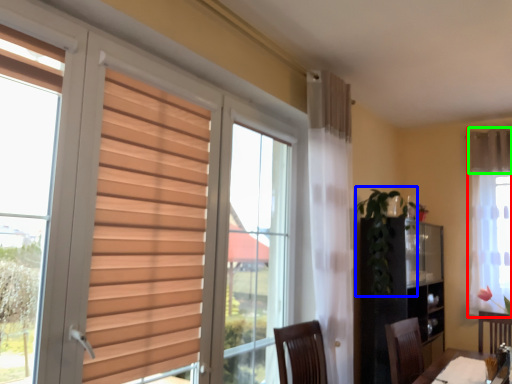
Question: Which is nearer to the curtain (highlighted by a red box)? plant (highlighted by a blue box) or curtain (highlighted by a green box).

Choices:
 (A) plant
 (B) curtain

Answer: (B)